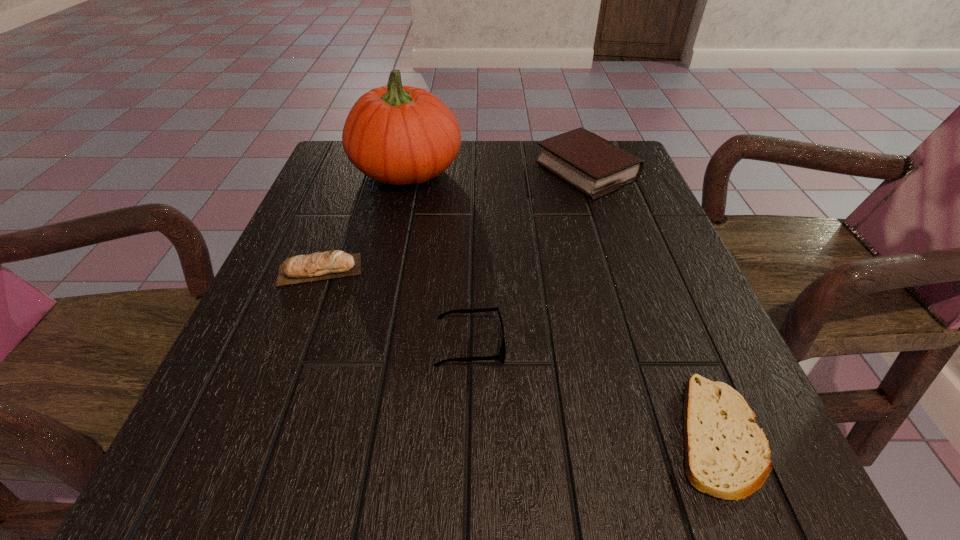
This screenshot has height=540, width=960. Identify the location of object positioned at the far right corner. (596, 167).

This screenshot has height=540, width=960. I want to click on object that is at the near right corner, so click(x=727, y=455).

In the image, there is a desktop. Identify the location of free space at the far edge. The image size is (960, 540). (519, 181).

Find the location of `free location at the near edge of the desktop`. free location at the near edge of the desktop is located at coordinates (603, 460).

Locate an element on the screen. The width and height of the screenshot is (960, 540). free point at the left edge is located at coordinates (316, 340).

Identify the location of free space at the right edge of the desktop. This screenshot has width=960, height=540. (633, 288).

Image resolution: width=960 pixels, height=540 pixels. In the image, there is a desktop. What are the coordinates of `vacant space at the far left corner` in the screenshot? It's located at (350, 188).

This screenshot has height=540, width=960. In the image, there is a desktop. Identify the location of free space at the near left corner. (233, 498).

Where is `vacant space in between the fourth shortest object and the taller pita bread`? This screenshot has height=540, width=960. vacant space in between the fourth shortest object and the taller pita bread is located at coordinates (453, 221).

What are the coordinates of `free space that is in between the sunglasses and the Bible` in the screenshot? It's located at (528, 258).